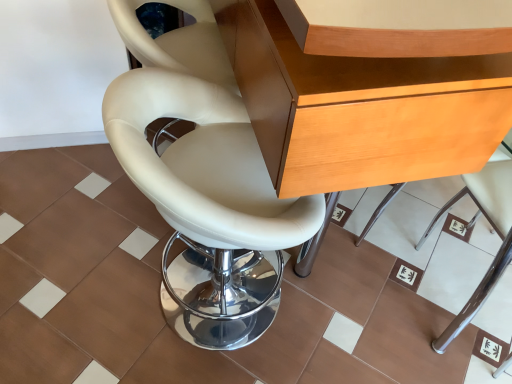
Image resolution: width=512 pixels, height=384 pixels. What are the coordinates of `vacant space to the left of white leather chair at center, positioned as the first chair in left-to-right order` in the screenshot? It's located at (89, 274).